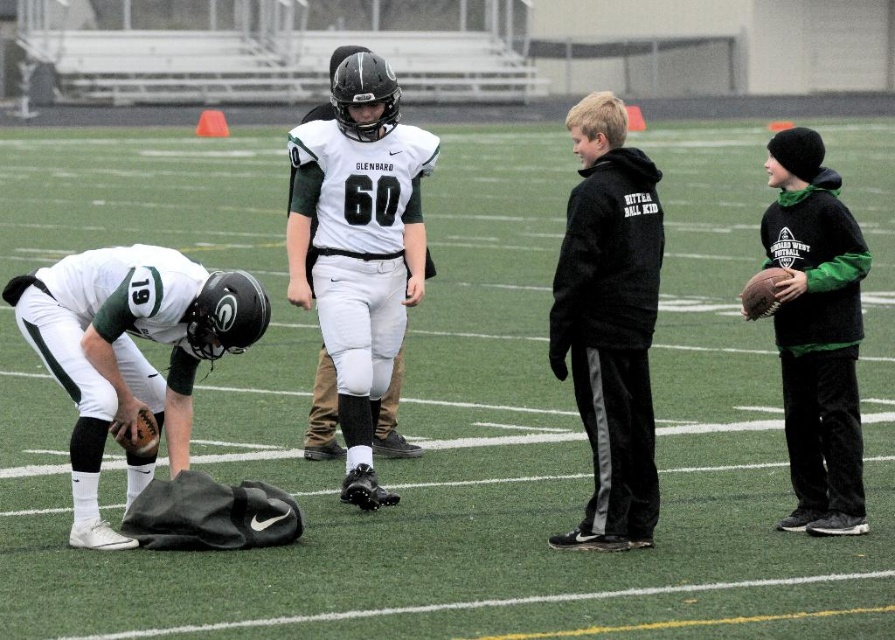
Which is more to the left, matte white uniform at lower left or black fleece hoodie at center?

matte white uniform at lower left is more to the left.

Between matte white uniform at lower left and black fleece hoodie at center, which one is positioned lower?

matte white uniform at lower left

The height and width of the screenshot is (640, 895). What do you see at coordinates (129, 349) in the screenshot? I see `matte white uniform at lower left` at bounding box center [129, 349].

Find the location of a particular element. The image size is (895, 640). matte white uniform at lower left is located at coordinates (129, 349).

Can you confirm if black fleece hoodie at center is wider than dark green fleece hoodie at right?

In fact, black fleece hoodie at center might be narrower than dark green fleece hoodie at right.

Who is lower down, black fleece hoodie at center or dark green fleece hoodie at right?

Positioned lower is dark green fleece hoodie at right.

The image size is (895, 640). What do you see at coordinates (609, 323) in the screenshot? I see `black fleece hoodie at center` at bounding box center [609, 323].

I want to click on black fleece hoodie at center, so click(609, 323).

Between matte white uniform at lower left and dark green fleece hoodie at right, which one is positioned higher?

dark green fleece hoodie at right

Does matte white uniform at lower left have a lesser height compared to dark green fleece hoodie at right?

Yes.

Is point (13, 292) behind point (823, 524)?

No, (13, 292) is in front of (823, 524).

Find the location of a particular element. The width and height of the screenshot is (895, 640). matte white uniform at lower left is located at coordinates (129, 349).